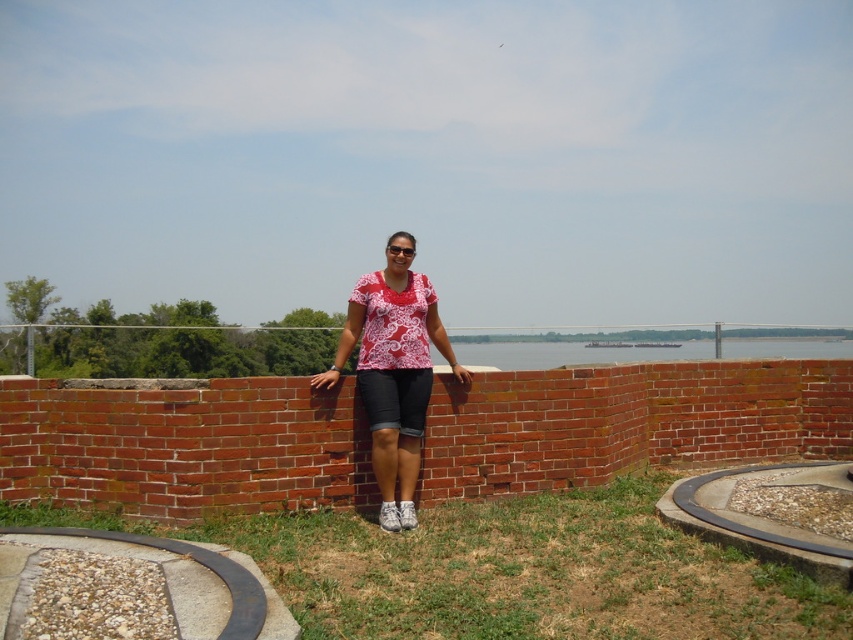
Measure the distance between green grass at lower center and clear water at center.

The distance of green grass at lower center from clear water at center is 23.46 feet.

Between point (560, 520) and point (766, 346), which one is positioned behind?

The point (766, 346) is more distant.

I want to click on green grass at lower center, so click(x=509, y=570).

From the picture: Is green grass at lower center to the left of matte red shirt at center from the viewer's perspective?

In fact, green grass at lower center is to the right of matte red shirt at center.

Who is more forward, (610,490) or (384,406)?

Point (384,406) is in front.

Find the location of a particular element. This screenshot has height=640, width=853. green grass at lower center is located at coordinates (509, 570).

Does point (408, 464) come behind point (572, 349)?

No, (408, 464) is in front of (572, 349).

Which is in front, point (416, 384) or point (780, 349)?

Point (416, 384) is more forward.

Who is more forward, (370,419) or (473,364)?

Point (370,419)

Find the location of a particular element. The width and height of the screenshot is (853, 640). matte red shirt at center is located at coordinates (393, 371).